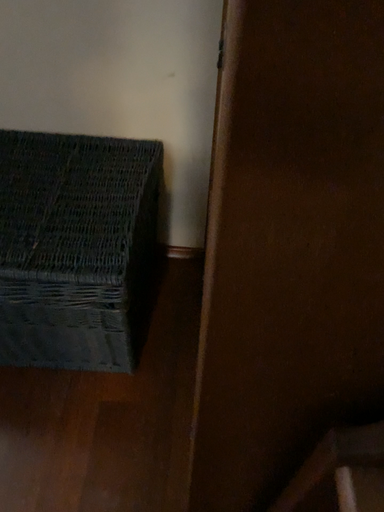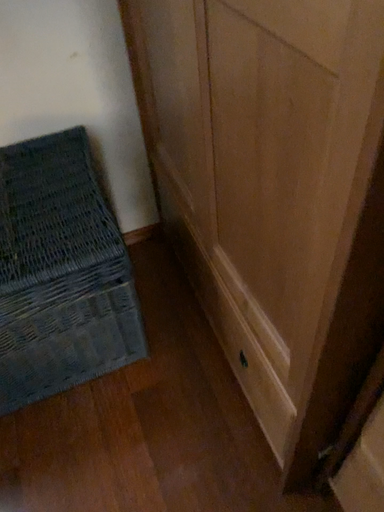
Question: Which way did the camera rotate in the video?

Choices:
 (A) rotated left
 (B) rotated right

Answer: (B)